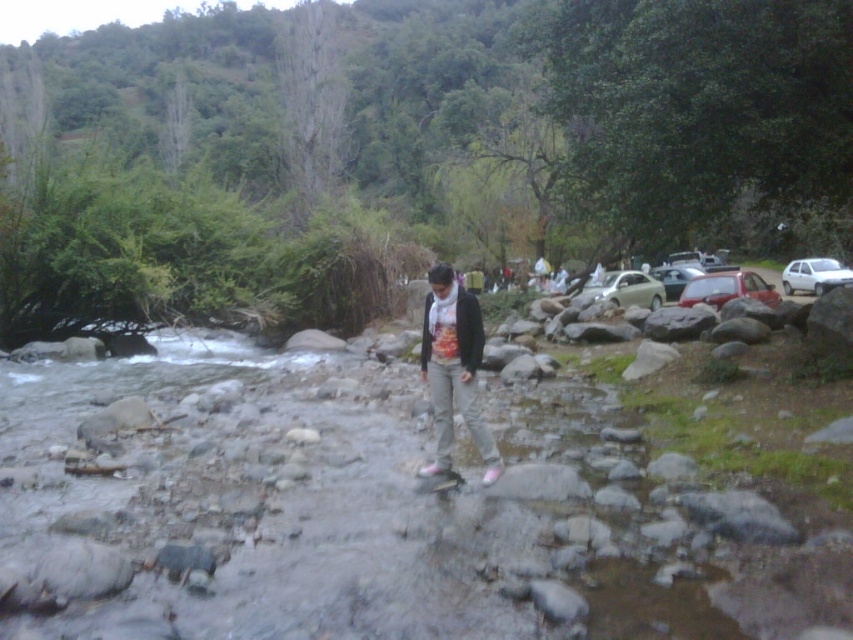
Question: Does printed cotton shirt at center appear on the right side of metallic silver car at right?

Choices:
 (A) yes
 (B) no

Answer: (B)

Question: Is metallic red car at right thinner than metallic silver car at right?

Choices:
 (A) no
 (B) yes

Answer: (A)

Question: Is metallic red car at right above metallic silver car at right?

Choices:
 (A) no
 (B) yes

Answer: (B)

Question: Estimate the real-world distances between objects in this image. Which object is closer to the white matte car at right?

Choices:
 (A) metallic red car at right
 (B) metallic silver car at right
 (C) printed cotton shirt at center

Answer: (B)

Question: Which of the following is the farthest from the observer?

Choices:
 (A) metallic red car at right
 (B) metallic silver car at right
 (C) printed cotton shirt at center
 (D) white matte car at right

Answer: (D)

Question: Which object is the farthest from the printed cotton shirt at center?

Choices:
 (A) metallic red car at right
 (B) white matte car at right

Answer: (B)